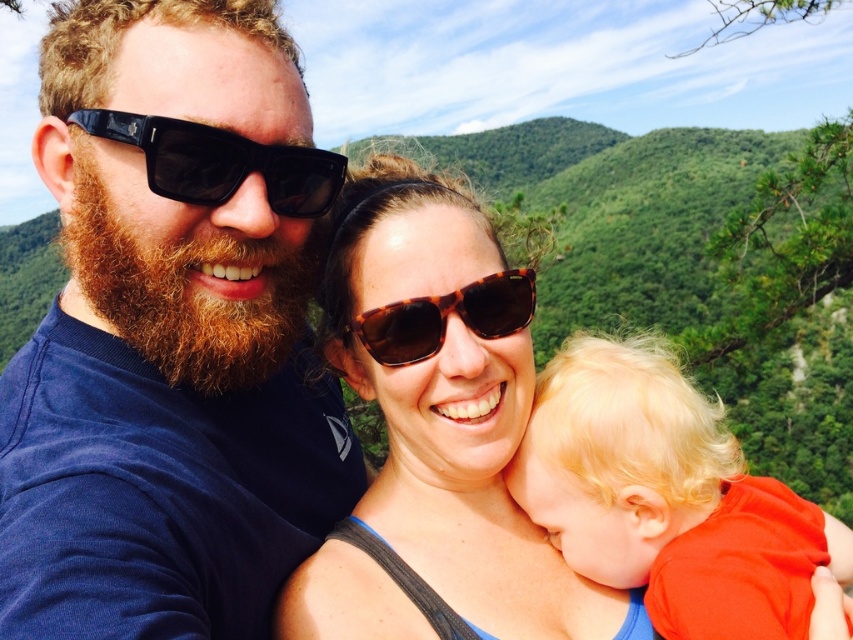
Question: Can you confirm if brown tortoiseshell sunglasses at center is wider than black plastic sunglasses at left?

Choices:
 (A) yes
 (B) no

Answer: (A)

Question: Which point is closer to the camera?

Choices:
 (A) (529, 316)
 (B) (149, 188)
 (C) (461, 240)

Answer: (B)

Question: Which of the following is the closest to the observer?

Choices:
 (A) blonde hair at center
 (B) tortoiseshell sunglasses at center
 (C) reddish-brown fuzzy beard at left
 (D) black plastic sunglasses at left

Answer: (A)

Question: From the image, what is the correct spatial relationship of brown tortoiseshell sunglasses at center in relation to blonde hair at center?

Choices:
 (A) left
 (B) right

Answer: (A)

Question: Is blonde hair at center thinner than reddish-brown fuzzy beard at left?

Choices:
 (A) no
 (B) yes

Answer: (B)

Question: Based on their relative distances, which object is farther from the reddish-brown fuzzy beard at left?

Choices:
 (A) blonde hair at center
 (B) brown tortoiseshell sunglasses at center
 (C) tortoiseshell sunglasses at center
 (D) black plastic sunglasses at left

Answer: (A)